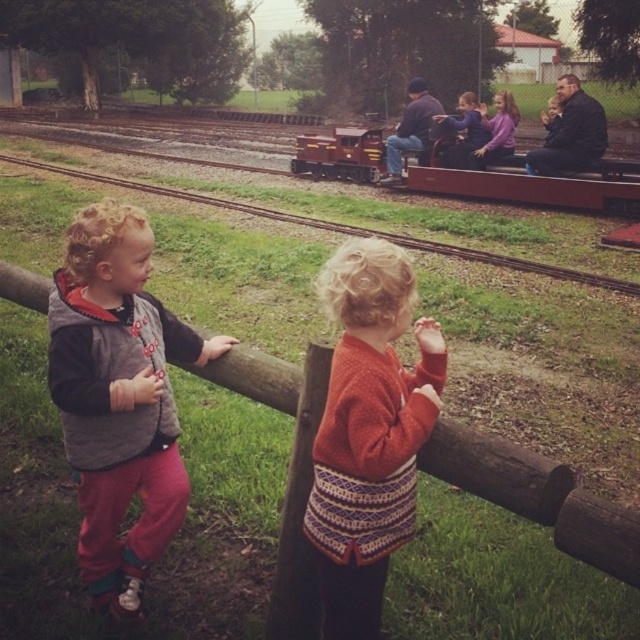
Question: Is wooden toy train at center closer to camera compared to knitted wool sweater at upper center?

Choices:
 (A) no
 (B) yes

Answer: (A)

Question: Considering the relative positions of knitted sweater at center and brown wooden fence at lower center in the image provided, where is knitted sweater at center located with respect to brown wooden fence at lower center?

Choices:
 (A) below
 (B) above

Answer: (A)

Question: Which of these objects is positioned farthest from the wooden toy train at center?

Choices:
 (A) knitted sweater at center
 (B) brown wooden fence at lower center

Answer: (A)

Question: Can you confirm if grey fleece vest at left is positioned to the left of brown wooden fence at lower center?

Choices:
 (A) no
 (B) yes

Answer: (A)

Question: Which object is positioned farthest from the brown wooden fence at lower center?

Choices:
 (A) knitted sweater at center
 (B) wooden toy train at center
 (C) knitted wool sweater at upper center

Answer: (A)

Question: Which object is closer to the camera taking this photo?

Choices:
 (A) wooden toy train at center
 (B) grey fleece vest at left
 (C) knitted wool sweater at upper center
 (D) knitted sweater at center

Answer: (D)